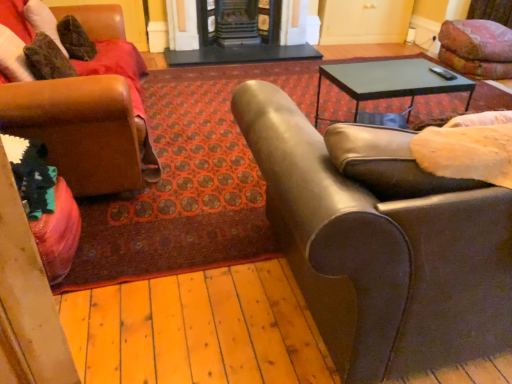
Question: Is marble fireplace at center, which is the first fireplace from left to right, positioned before leather couch at right, the 2th chair when ordered from left to right?

Choices:
 (A) no
 (B) yes

Answer: (A)

Question: Does marble fireplace at center, which is the first fireplace from left to right, turn towards leather couch at right, the 1th chair viewed from the right?

Choices:
 (A) no
 (B) yes

Answer: (B)

Question: From the image's perspective, is marble fireplace at center, arranged as the 2th fireplace when viewed from the right, above leather couch at right, the 1th chair viewed from the right?

Choices:
 (A) yes
 (B) no

Answer: (A)

Question: Does marble fireplace at center, arranged as the 2th fireplace when viewed from the right, have a lesser width compared to leather couch at right, the 2th chair when ordered from left to right?

Choices:
 (A) yes
 (B) no

Answer: (A)

Question: From a real-world perspective, is metallic gray table at upper right positioned above or below velvet pink cushion at upper right?

Choices:
 (A) above
 (B) below

Answer: (A)

Question: Is metallic gray table at upper right situated inside velvet pink cushion at upper right or outside?

Choices:
 (A) outside
 (B) inside

Answer: (A)

Question: Considering the positions of metallic gray table at upper right and velvet pink cushion at upper right in the image, is metallic gray table at upper right bigger or smaller than velvet pink cushion at upper right?

Choices:
 (A) big
 (B) small

Answer: (B)

Question: Is point (389, 97) closer or farther from the camera than point (456, 39)?

Choices:
 (A) farther
 (B) closer

Answer: (B)

Question: From a real-world perspective, is marble fireplace at center, the second fireplace positioned from the left, physically located above or below black glossy table at center?

Choices:
 (A) above
 (B) below

Answer: (A)

Question: In terms of height, does marble fireplace at center, the second fireplace positioned from the left, look taller or shorter compared to black glossy table at center?

Choices:
 (A) short
 (B) tall

Answer: (B)

Question: In the image, is marble fireplace at center, which is counted as the 1th fireplace, starting from the right, on the left side or the right side of black glossy table at center?

Choices:
 (A) left
 (B) right

Answer: (A)

Question: Do you think marble fireplace at center, which is counted as the 1th fireplace, starting from the right, is within black glossy table at center, or outside of it?

Choices:
 (A) outside
 (B) inside

Answer: (A)

Question: From a real-world perspective, is leather at left, the 1th chair in the left-to-right sequence, physically located above or below black glossy table at center?

Choices:
 (A) above
 (B) below

Answer: (A)

Question: From the image's perspective, is leather at left, which is the 2th chair from right to left, above or below black glossy table at center?

Choices:
 (A) above
 (B) below

Answer: (B)